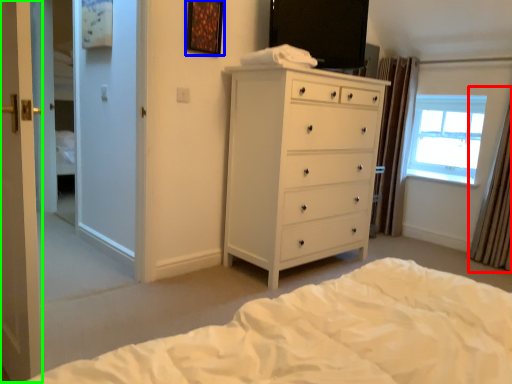
Question: Which object is positioned closest to curtain (highlighted by a red box)? Select from picture frame (highlighted by a blue box) and screen door (highlighted by a green box).

Choices:
 (A) picture frame
 (B) screen door

Answer: (A)